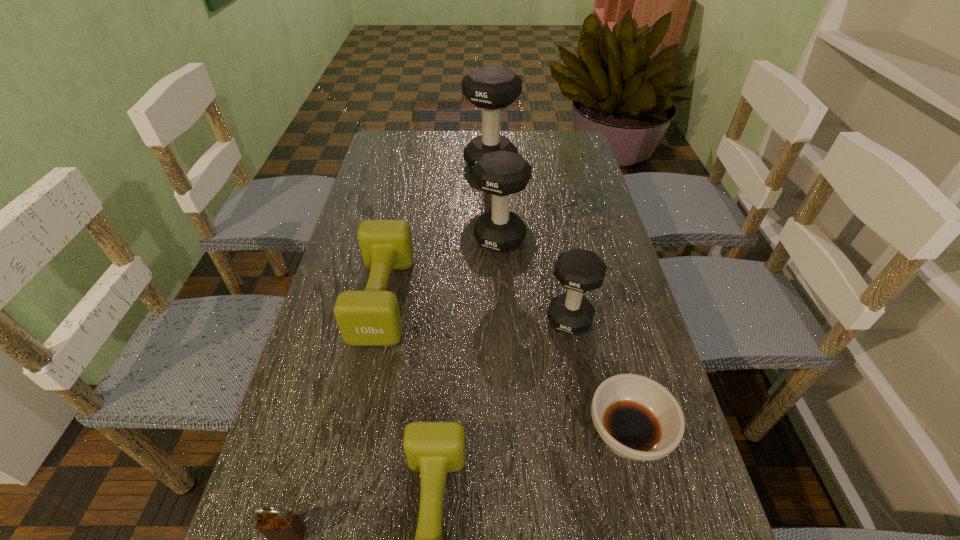
Locate an element on the screen. gray dumbbell that is the closest to the tallest dumbbell is located at coordinates (501, 173).

Locate an element on the screen. This screenshot has height=540, width=960. olive dumbbell that can be found as the closest to the padlock is located at coordinates (432, 448).

Identify the location of olive dumbbell identified as the second closest to the soup bowl. (371, 317).

The width and height of the screenshot is (960, 540). Find the location of `vacant space that satisfies the following two spatial constraints: 1. on the front side of the soup bowl; 2. on the left side of the farther olive dumbbell`. vacant space that satisfies the following two spatial constraints: 1. on the front side of the soup bowl; 2. on the left side of the farther olive dumbbell is located at coordinates (354, 436).